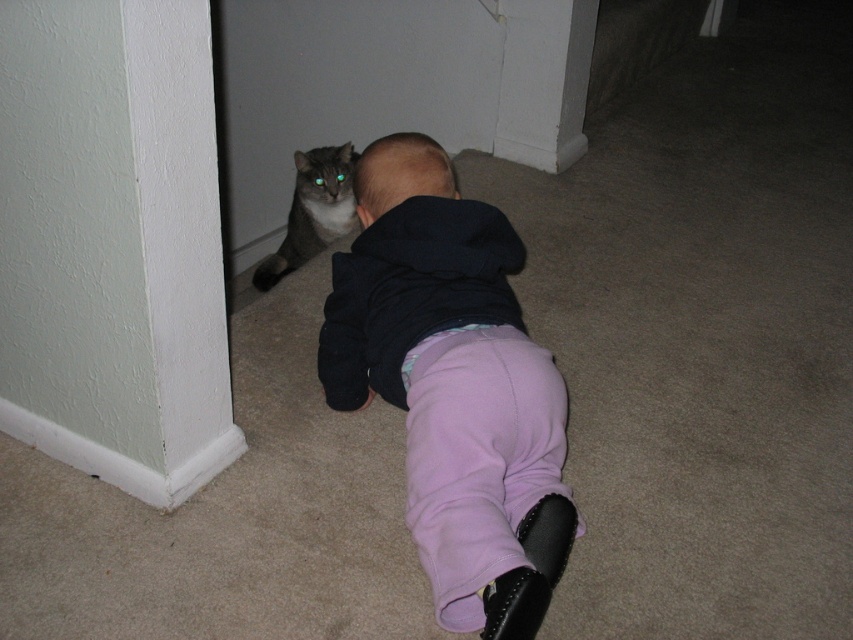
Question: Which point is farther to the camera?

Choices:
 (A) gray fur cat at left
 (B) smooth black hair at center

Answer: (A)

Question: Where is gray fur cat at left located in relation to smooth black hair at center in the image?

Choices:
 (A) above
 (B) below

Answer: (A)

Question: Which of the following is the farthest from the observer?

Choices:
 (A) (322, 236)
 (B) (358, 211)

Answer: (A)

Question: Estimate the real-world distances between objects in this image. Which object is farther from the purple fleece pants at center?

Choices:
 (A) smooth black hair at center
 (B) gray fur cat at left

Answer: (B)

Question: Is gray fur cat at left positioned before smooth black hair at center?

Choices:
 (A) yes
 (B) no

Answer: (B)

Question: Is purple fleece pants at center above smooth black hair at center?

Choices:
 (A) no
 (B) yes

Answer: (A)